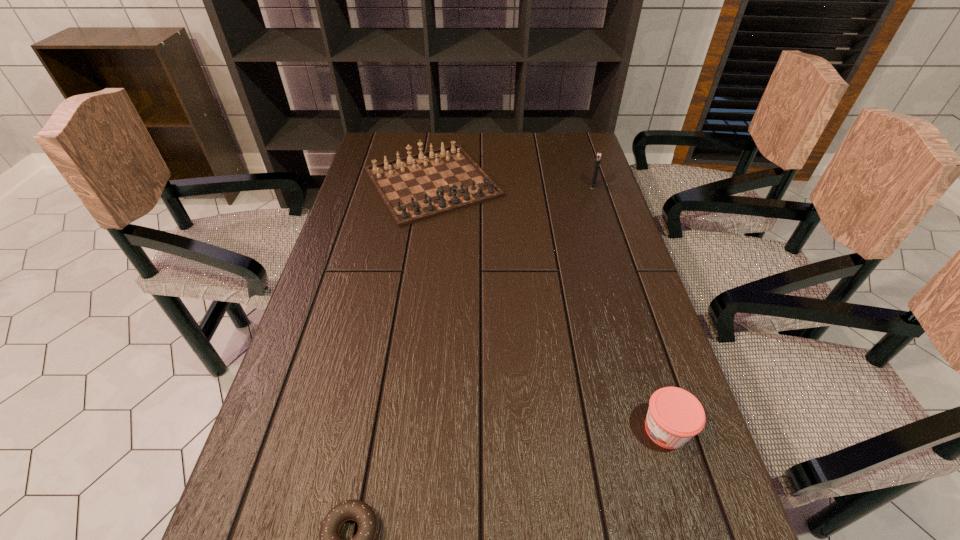
At what (x,y) coordinates should I click in order to perform the action: click on igniter situated at the right edge. Please return your answer as a coordinate pair (x, y). Image resolution: width=960 pixels, height=540 pixels. Looking at the image, I should click on (598, 157).

Find the location of a particular element. The height and width of the screenshot is (540, 960). jam situated at the right edge is located at coordinates (674, 416).

Image resolution: width=960 pixels, height=540 pixels. I want to click on object that is at the far left corner, so click(414, 188).

You are a GUI agent. You are given a task and a screenshot of the screen. Output one action in this format:
    pyautogui.click(x=<x>, y=<y>)
    Task: Click on the vacant space at the far edge of the desktop
    The width and height of the screenshot is (960, 540).
    Given the screenshot: What is the action you would take?
    pyautogui.click(x=445, y=144)

In the image, there is a desktop. Where is `vacant space at the left edge`? Image resolution: width=960 pixels, height=540 pixels. vacant space at the left edge is located at coordinates (367, 224).

Identify the location of free point at the right edge. (674, 380).

The width and height of the screenshot is (960, 540). In the image, there is a desktop. What are the coordinates of `free space at the far left corner` in the screenshot? It's located at (396, 149).

Identify the location of vacant space at the far right corner of the desktop. (560, 142).

Where is `empty space between the jam and the chessboard`? This screenshot has width=960, height=540. empty space between the jam and the chessboard is located at coordinates (549, 306).

The height and width of the screenshot is (540, 960). What are the coordinates of `free point between the igniter and the chessboard` in the screenshot? It's located at (513, 184).